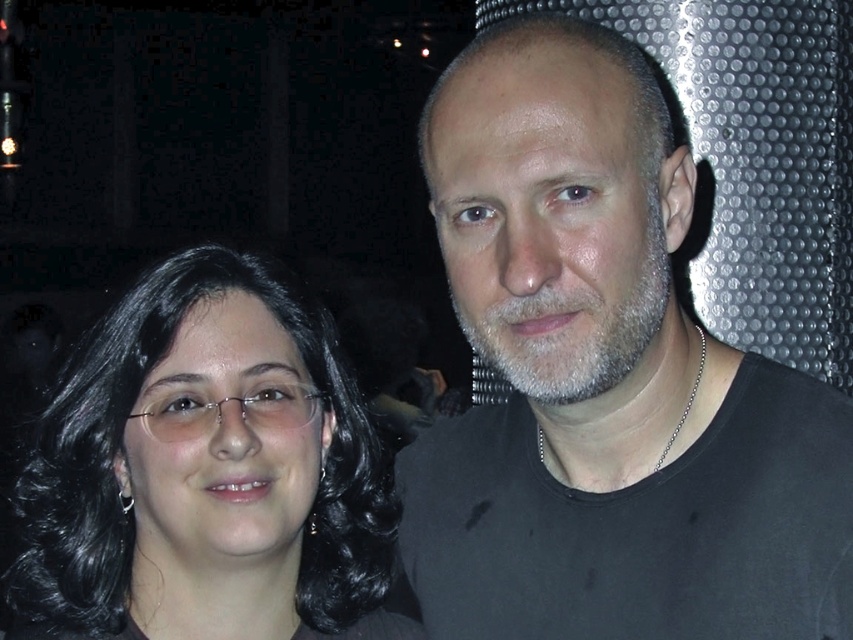
You are an artist trying to sketch the scene. You need to place the black matte shirt at upper right in your drawing. What are the coordinates for its position?

The coordinates for the black matte shirt at upper right are point (604,380).

In the scene shown: You are a photographer trying to capture a clear shot of the black hair at left without the black matte shirt at upper right blocking it. Is this possible given their positions?

The black matte shirt at upper right is in front of the black hair at left, so it is blocking the view. To capture the black hair at left clearly, you would need to adjust the angle or have the subject move to avoid the obstruction.